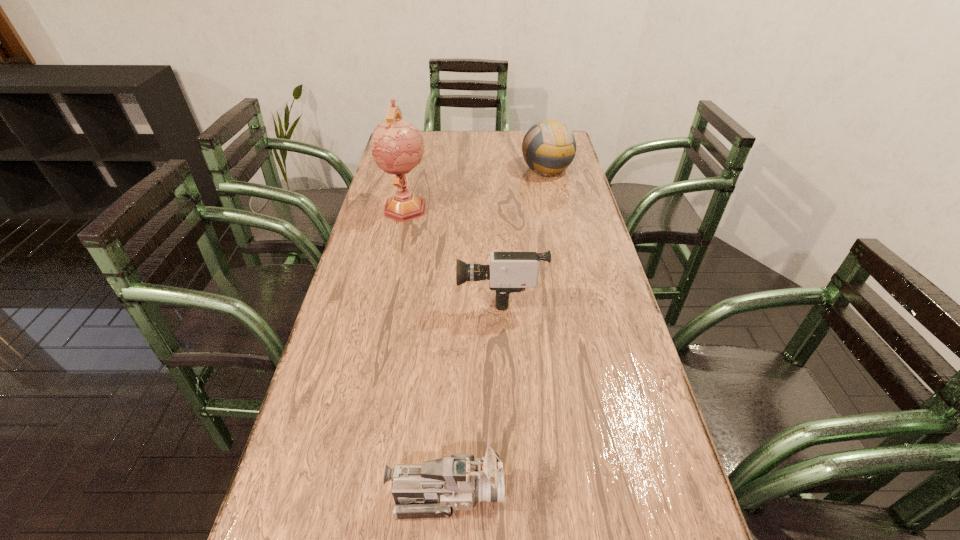
Where is `vacant area situated 0.050m on the recording direction of the farther camcorder`? The width and height of the screenshot is (960, 540). vacant area situated 0.050m on the recording direction of the farther camcorder is located at coordinates (441, 293).

The image size is (960, 540). I want to click on blank space located on the recording direction of the farther camcorder, so click(404, 293).

Locate an element on the screen. free space located 0.160m on the front-facing side of the nearer camcorder is located at coordinates (588, 494).

The image size is (960, 540). Identify the location of object at the far edge. (549, 146).

At what (x,y) coordinates should I click in order to perform the action: click on object that is at the left edge. Please return your answer as a coordinate pair (x, y). The image size is (960, 540). Looking at the image, I should click on (397, 146).

Where is `object positioned at the right edge`? The width and height of the screenshot is (960, 540). object positioned at the right edge is located at coordinates (549, 146).

What are the coordinates of `object that is positioned at the far right corner` in the screenshot? It's located at (549, 146).

In the image, there is a desktop. Where is `free space at the far edge`? This screenshot has width=960, height=540. free space at the far edge is located at coordinates (501, 139).

Locate an element on the screen. Image resolution: width=960 pixels, height=540 pixels. vacant area at the left edge of the desktop is located at coordinates (372, 200).

The image size is (960, 540). In the image, there is a desktop. In order to click on free space at the right edge in this screenshot , I will do `click(564, 173)`.